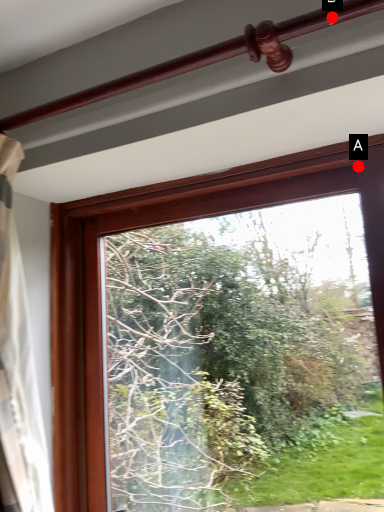
Question: Two points are circled on the image, labeled by A and B beside each circle. Which of the following is the closest to the observer?

Choices:
 (A) A is closer
 (B) B is closer

Answer: (B)